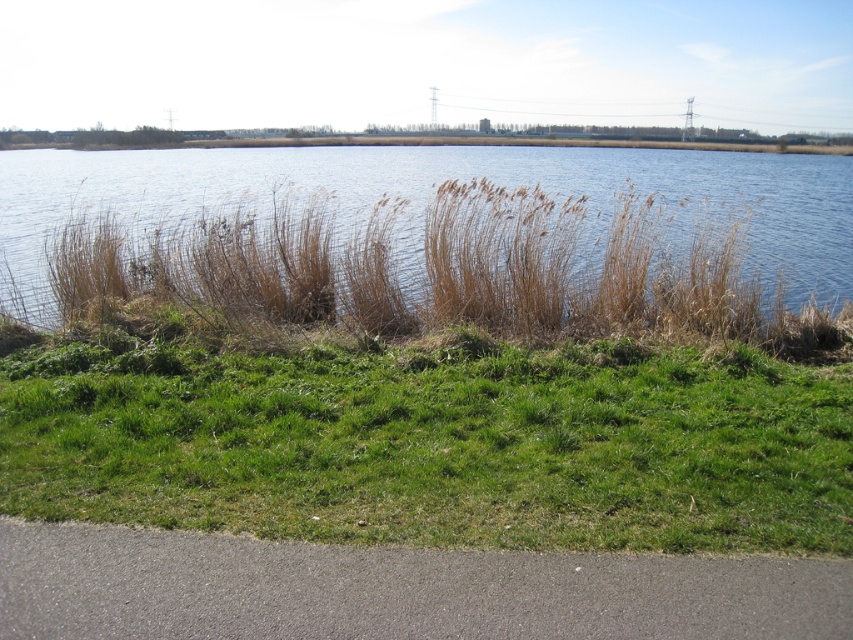
Question: Which point is closer to the camera?

Choices:
 (A) (44, 422)
 (B) (236, 150)

Answer: (A)

Question: Can you confirm if green grass at lower center is positioned above gray asphalt curb at lower left?

Choices:
 (A) yes
 (B) no

Answer: (A)

Question: Is green grass at lower center behind brown grassy water at center?

Choices:
 (A) yes
 (B) no

Answer: (B)

Question: Which point is closer to the camera?

Choices:
 (A) (844, 387)
 (B) (461, 545)
 (C) (509, 156)

Answer: (B)

Question: Can you confirm if green grass at lower center is thinner than gray asphalt curb at lower left?

Choices:
 (A) no
 (B) yes

Answer: (A)

Question: Which object appears farthest from the camera in this image?

Choices:
 (A) brown grassy water at center
 (B) gray asphalt curb at lower left
 (C) green grass at lower center

Answer: (A)